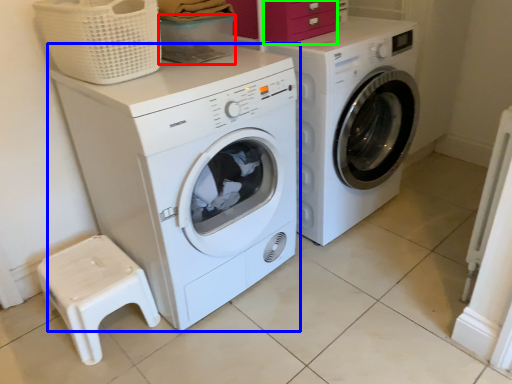
Question: Considering the real-world distances, which object is farthest from storage box (highlighted by a red box)? washing machine (highlighted by a blue box) or drawer (highlighted by a green box)?

Choices:
 (A) washing machine
 (B) drawer

Answer: (A)